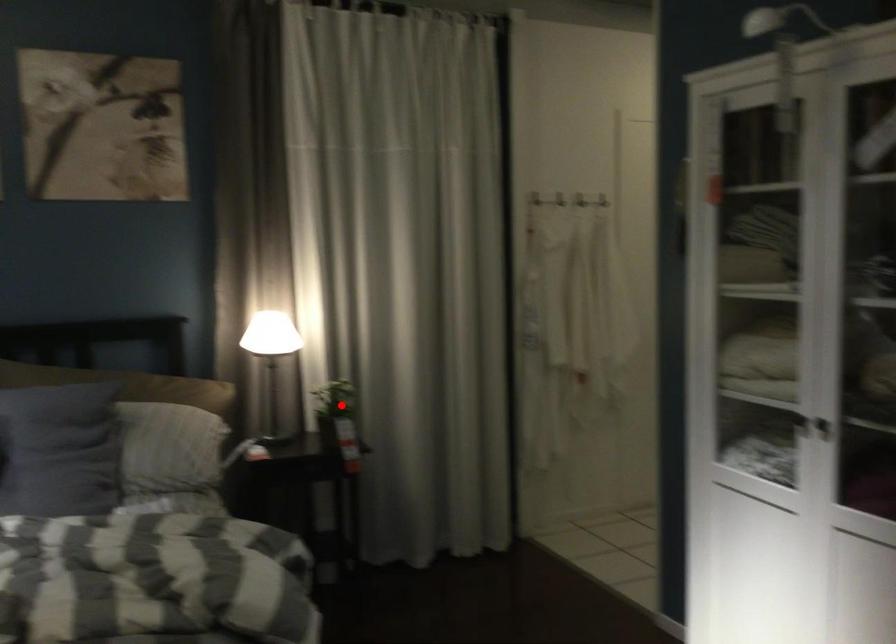
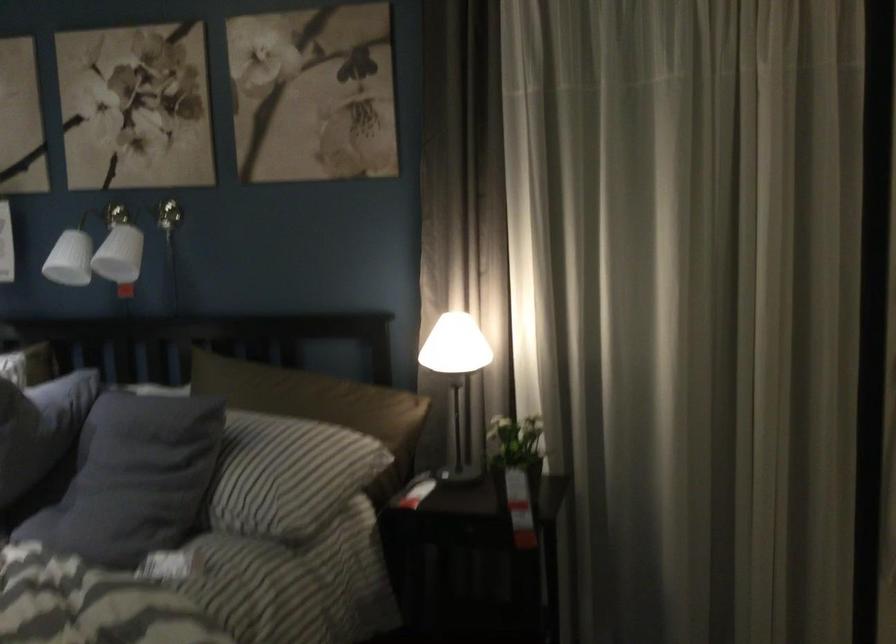
Question: I am providing you with two images of the same scene from different viewpoints. In image1, a red point is highlighted. Considering the same 3D point in image2, which of the following is correct?

Choices:
 (A) It is closer
 (B) It is farther

Answer: (A)